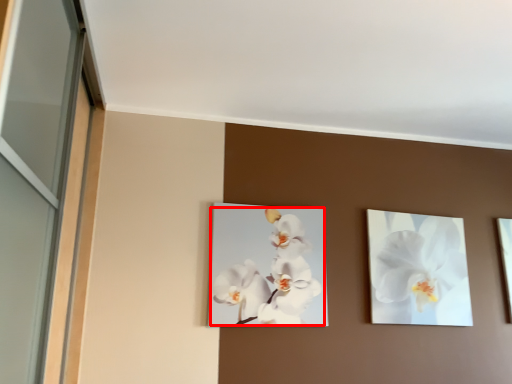
Question: In this image, where is flower (annotated by the red box) located relative to flower?

Choices:
 (A) right
 (B) left

Answer: (B)